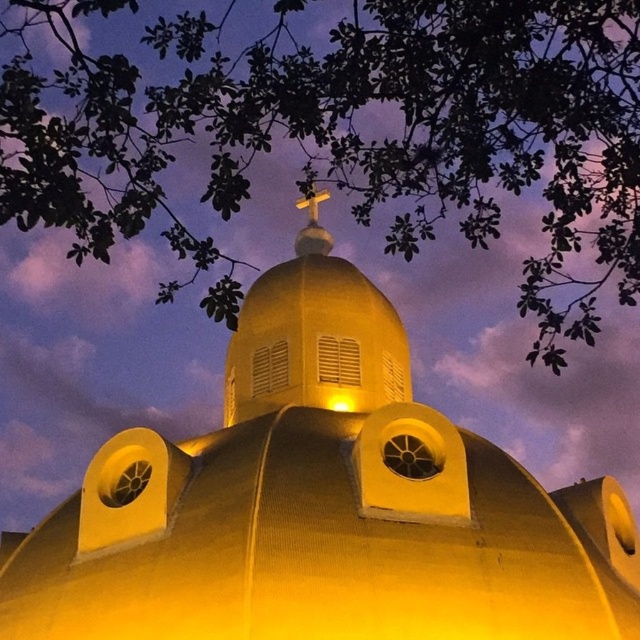
Question: Is green leafy tree at upper center positioned behind gold metallic cross at center?

Choices:
 (A) no
 (B) yes

Answer: (A)

Question: Which of these objects is positioned closest to the gold metallic cross at center?

Choices:
 (A) green leafy tree at upper center
 (B) golden matte dome at center

Answer: (B)

Question: Considering the real-world distances, which object is closest to the green leafy tree at upper center?

Choices:
 (A) gold metallic cross at center
 (B) golden matte dome at center

Answer: (A)

Question: Where is green leafy tree at upper center located in relation to gold metallic cross at center in the image?

Choices:
 (A) above
 (B) below

Answer: (A)

Question: Which object appears closest to the camera in this image?

Choices:
 (A) green leafy tree at upper center
 (B) gold metallic cross at center

Answer: (A)

Question: Does golden matte dome at center appear on the left side of gold metallic cross at center?

Choices:
 (A) yes
 (B) no

Answer: (A)